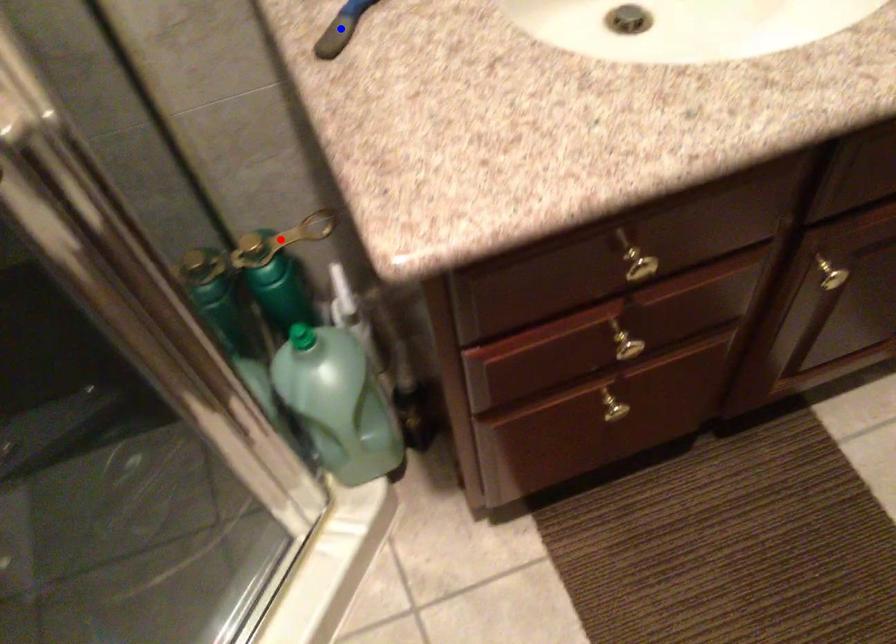
Question: In the image, two points are highlighted. Which point is nearer to the camera? Reply with the corresponding letter.

Choices:
 (A) blue point
 (B) red point

Answer: (A)